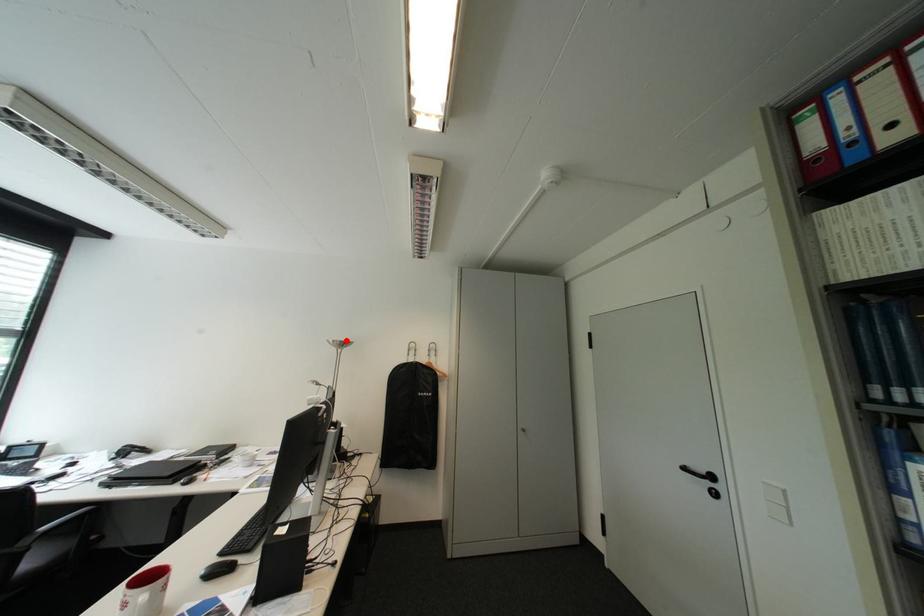
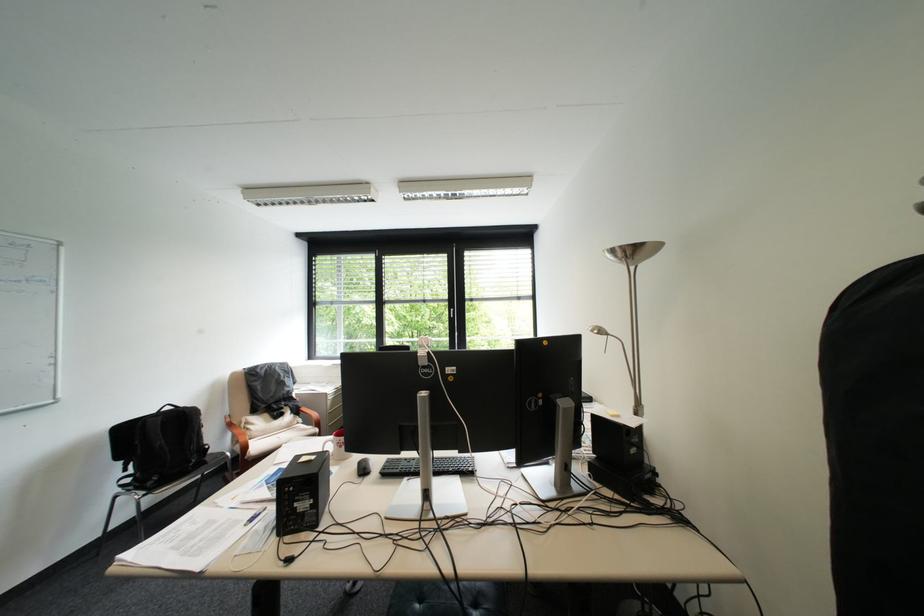
Question: I am providing you with two images of the same scene from different viewpoints. A red point is marked on the first image. At the location where the point appears in image 1, is it still visible in image 2?

Choices:
 (A) Yes
 (B) No

Answer: (A)